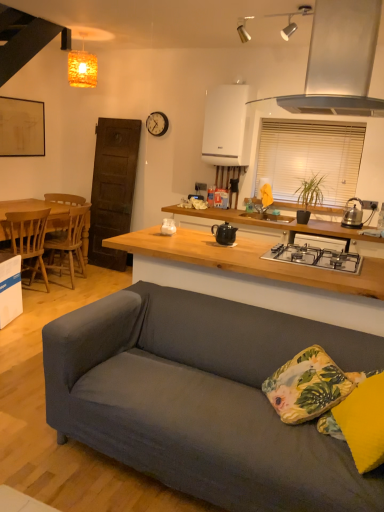
Where is `free space in front of white glossy coffee cup at center`? This screenshot has height=512, width=384. free space in front of white glossy coffee cup at center is located at coordinates (172, 237).